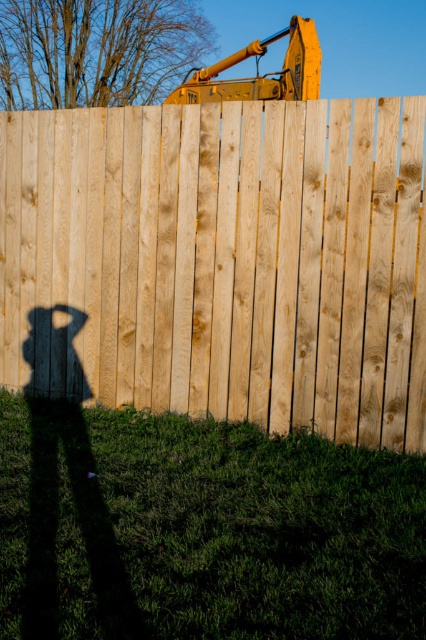
Between natural wood fence at center and yellow metallic excavator at upper center, which one is positioned higher?

yellow metallic excavator at upper center is higher up.

Is natural wood fence at center taller than yellow metallic excavator at upper center?

Incorrect, natural wood fence at center's height is not larger of yellow metallic excavator at upper center's.

Who is more distant from viewer, (161, 198) or (259, 42)?

The point (259, 42) is more distant.

At what (x,y) coordinates should I click in order to perform the action: click on natural wood fence at center. Please return your answer as a coordinate pair (x, y). Looking at the image, I should click on (221, 262).